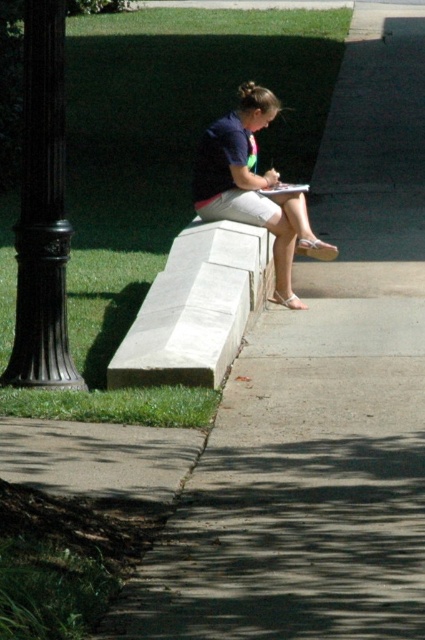
In the scene shown: You are standing at the center of the paved area and want to locate the black polished metal pole at left. According to the scene, where should you look relative to your position?

The black polished metal pole at left is located at the coordinates point (42, 211), so you should look to your left side to find it.

A person is sitting on a stone bench in a park. They want to throw a small ball to their friend who is standing at the point marked as point (229, 307). If the person can throw the ball up to 10 meters, will they be able to reach their friend?

The distance between the person and the point (229, 307) is 9.79 meters. Since the person can throw the ball up to 10 meters, they will be able to reach their friend at point (229, 307).

You are a photographer planning to take a portrait of the person sitting on the white stone bench at center. You want to ensure the matte blue shirt at center is clearly visible in the frame. Given the spatial relationship between the two objects, what adjustment should you make to your camera angle?

Since the white stone bench at center is thinner than the matte blue shirt at center, you should position the camera slightly lower to ensure the matte blue shirt at center is fully visible without being obscured by the bench.